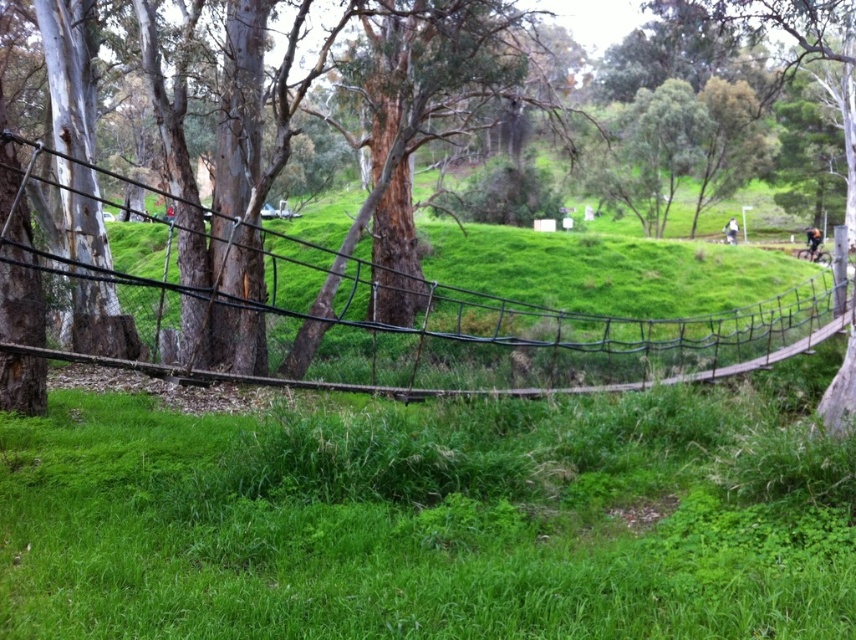
Is green grassy at center above black wire mesh at center?

No.

How much distance is there between green grassy at center and black wire mesh at center?

green grassy at center is 4.35 meters from black wire mesh at center.

Which is in front, point (271, 504) or point (712, 358)?

Positioned in front is point (271, 504).

At what (x,y) coordinates should I click in order to perform the action: click on green grassy at center. Please return your answer as a coordinate pair (x, y). The image size is (856, 640). Looking at the image, I should click on point(402,532).